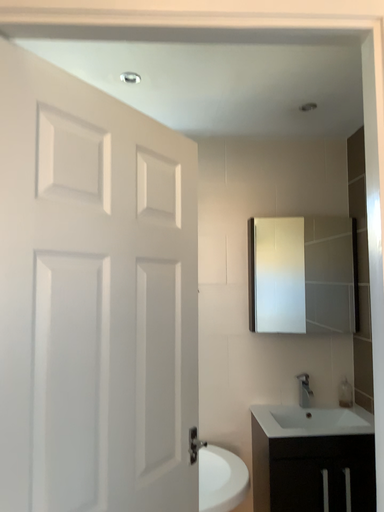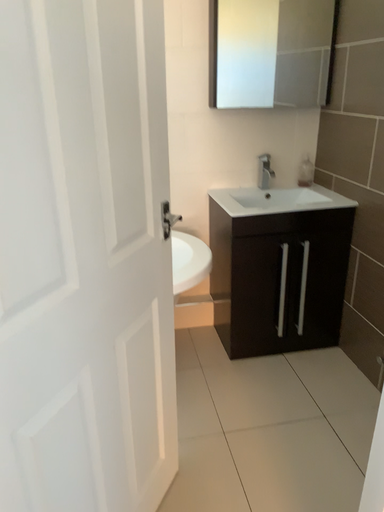
Question: Which way did the camera rotate in the video?

Choices:
 (A) rotated left
 (B) rotated right

Answer: (B)